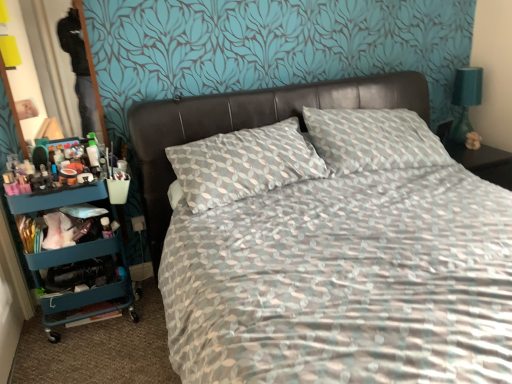
Measure the distance between point [470,96] and camera.

8.94 feet.

In order to face leather at center, should I rotate leftwards or rightwards?

Rotate left and turn 1.556 degrees.

At what (x,y) coordinates should I click in order to perform the action: click on teal fabric lampshade at right. Please return your answer as a coordinate pair (x, y). This screenshot has width=512, height=384. Looking at the image, I should click on (466, 99).

Which is more to the right, teal fabric lampshade at right or leather at center?

Positioned to the right is teal fabric lampshade at right.

From the image's perspective, is teal fabric lampshade at right under leather at center?

Actually, teal fabric lampshade at right appears above leather at center in the image.

Is teal fabric lampshade at right facing towards leather at center?

No, teal fabric lampshade at right is not oriented towards leather at center.

Would you say teal fabric lampshade at right is outside leather at center?

teal fabric lampshade at right is positioned outside leather at center.

Does teal plastic cart at left contain teal fabric lampshade at right?

Definitely not — teal fabric lampshade at right is not inside teal plastic cart at left.

From a real-world perspective, is teal plastic cart at left located beneath teal fabric lampshade at right?

Yes, from a real-world perspective, teal plastic cart at left is beneath teal fabric lampshade at right.

Looking at their sizes, would you say teal plastic cart at left is wider or thinner than teal fabric lampshade at right?

In the image, teal plastic cart at left appears to be wider than teal fabric lampshade at right.

From the image's perspective, is teal fabric lampshade at right above teal plastic cart at left?

Yes, from the image's perspective, teal fabric lampshade at right is above teal plastic cart at left.

Between teal fabric lampshade at right and teal plastic cart at left, which one has more height?

teal plastic cart at left.

Which of these two, teal fabric lampshade at right or teal plastic cart at left, is smaller?

teal fabric lampshade at right.

From a real-world perspective, between leather at center and teal plastic cart at left, who is vertically lower?

teal plastic cart at left, from a real-world perspective.

Do you think leather at center is within teal plastic cart at left, or outside of it?

leather at center is located beyond the bounds of teal plastic cart at left.

Is leather at center to the left of teal plastic cart at left from the viewer's perspective?

No.

Identify the location of bookshelf that is under the leather at center (from a real-world perspective). (88, 283).

From the picture: Are leather at center and teal fabric lampshade at right far apart?

leather at center is actually quite close to teal fabric lampshade at right.

Does leather at center appear on the right side of teal fabric lampshade at right?

Incorrect, leather at center is not on the right side of teal fabric lampshade at right.

What's the angular difference between leather at center and teal fabric lampshade at right's facing directions?

They differ by 2.08 degrees in their facing directions.

Is leather at center looking in the opposite direction of teal fabric lampshade at right?

No, leather at center's orientation is not away from teal fabric lampshade at right.

Is teal plastic cart at left shorter than leather at center?

In fact, teal plastic cart at left may be taller than leather at center.

Where is `headboard on the right side of teal plastic cart at left`? The width and height of the screenshot is (512, 384). headboard on the right side of teal plastic cart at left is located at coordinates (252, 119).

Does teal plastic cart at left appear on the left side of leather at center?

Correct, you'll find teal plastic cart at left to the left of leather at center.

In the scene shown: Considering the sizes of teal plastic cart at left and leather at center in the image, is teal plastic cart at left wider or thinner than leather at center?

teal plastic cart at left is thinner than leather at center.

Locate an element on the screen. headboard below the teal fabric lampshade at right (from the image's perspective) is located at coordinates (252, 119).

Find the location of a particular element. The width and height of the screenshot is (512, 384). bedside lamp above the teal plastic cart at left (from a real-world perspective) is located at coordinates (466, 99).

When comparing their distances from teal plastic cart at left, does teal fabric lampshade at right or leather at center seem further?

The object further to teal plastic cart at left is teal fabric lampshade at right.

From the image, which object appears to be nearer to teal plastic cart at left, leather at center or teal fabric lampshade at right?

The object closer to teal plastic cart at left is leather at center.

From the image, which object appears to be nearer to leather at center, teal fabric lampshade at right or teal plastic cart at left?

teal plastic cart at left is positioned closer to the anchor leather at center.

Based on their spatial positions, is teal plastic cart at left or leather at center closer to teal fabric lampshade at right?

leather at center is positioned closer to the anchor teal fabric lampshade at right.

Looking at the image, which one is located further to teal fabric lampshade at right, leather at center or teal plastic cart at left?

teal plastic cart at left lies further to teal fabric lampshade at right than the other object.

Based on their spatial positions, is teal plastic cart at left or teal fabric lampshade at right closer to leather at center?

teal plastic cart at left lies closer to leather at center than the other object.

Locate an element on the screen. This screenshot has height=384, width=512. headboard between teal plastic cart at left and teal fabric lampshade at right in the horizontal direction is located at coordinates (252, 119).